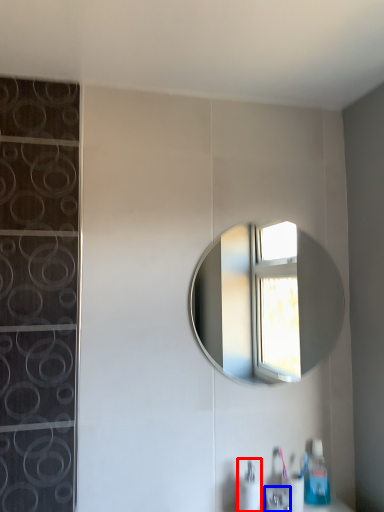
Question: Among these objects, which one is nearest to the camera, soap dispenser (highlighted by a red box) or faucet (highlighted by a blue box)?

Choices:
 (A) soap dispenser
 (B) faucet

Answer: (B)